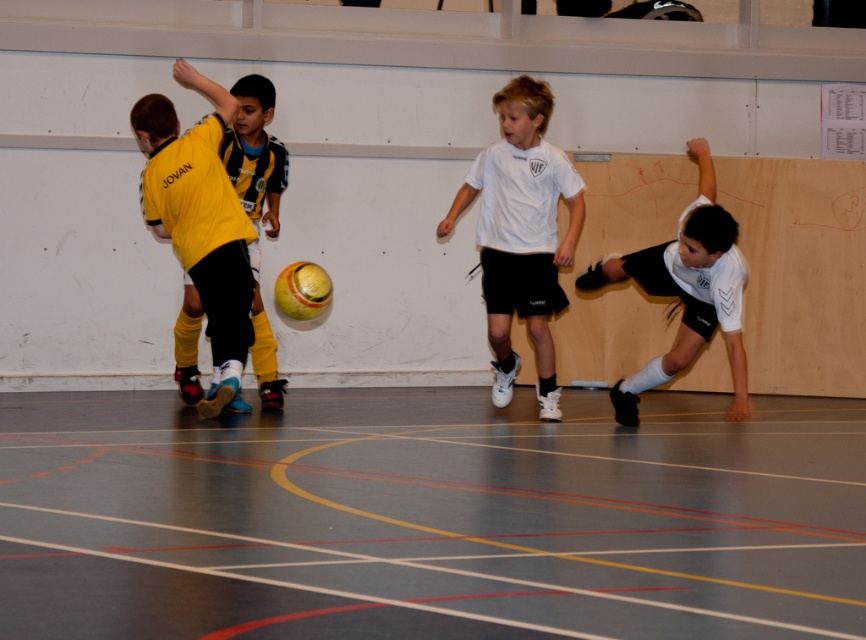
You are a referee in the indoor soccer game. You need to ensure players maintain a minimum distance of 5 meters between them during the game. Based on the image, is the distance between the yellow matte jersey at left and the white matte shorts at right sufficient to comply with the rule?

The yellow matte jersey at left is 5.60 meters away from the white matte shorts at right, which meets the minimum required distance of 5 meters. Therefore, the distance is sufficient to comply with the rule.

In the scene shown: You are an athlete preparing to slide tackle during an indoor soccer game. The smooth gray floor at center is where you need to reach. Based on the coordinates provided in the description, can you estimate if sliding towards the point mentioned would place you near the playing area or closer to the walls?

The smooth gray floor at center is located at point [430,516], which is within the central area of the gymnasium, so sliding towards this point would place you near the playing area rather than close to the walls.

You are a photographer setting up a camera at the center of the gymnasium. You need to ensure both the yellow matte jersey at left and the white matte shorts at right are in focus. Since the camera can only focus on objects of similar height, will you need to adjust the focus settings for one of them?

The yellow matte jersey at left is taller than the white matte shorts at right, so you will need to adjust the focus settings to accommodate their different heights.